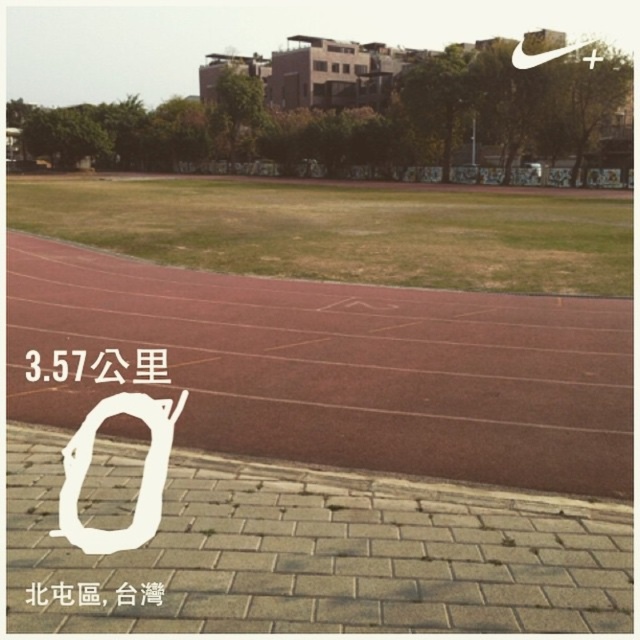
Question: Can you confirm if rubberized red track at center is positioned above black paper at center?

Choices:
 (A) no
 (B) yes

Answer: (B)

Question: In this image, where is rubberized red track at center located relative to black paper at center?

Choices:
 (A) right
 (B) left

Answer: (A)

Question: Which of the following is the farthest from the observer?

Choices:
 (A) rubberized red track at center
 (B) black paper at center

Answer: (B)

Question: Where is rubberized red track at center located in relation to black paper at center in the image?

Choices:
 (A) above
 (B) below

Answer: (A)